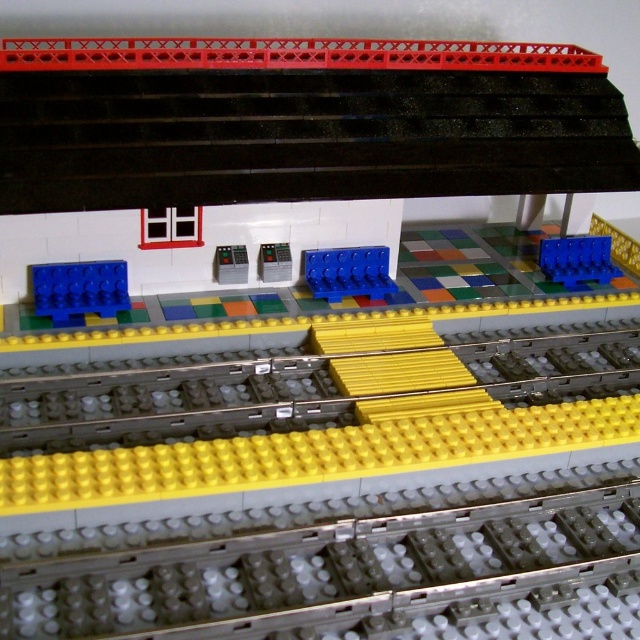
You are a LEGO builder trying to place a new blue matte brick on the structure. You have two options from your collection. The first is the blue matte brick at left, and the second is the blue matte brick at center. Which one should you choose if you want to cover a larger area on the LEGO model?

The blue matte brick at left has a larger size compared to the blue matte brick at center, so you should choose the blue matte brick at left to cover a larger area on the LEGO model.

You are a LEGO designer working on a train station model. You need to place a new yellow LEGO piece at coordinate point 0.455, 0.125. However, there is already a blue matte brick at left at that location. What should you do?

The blue matte brick at left is already located at point (80, 291), so you cannot place the new yellow LEGO piece there. You will need to choose a different location.